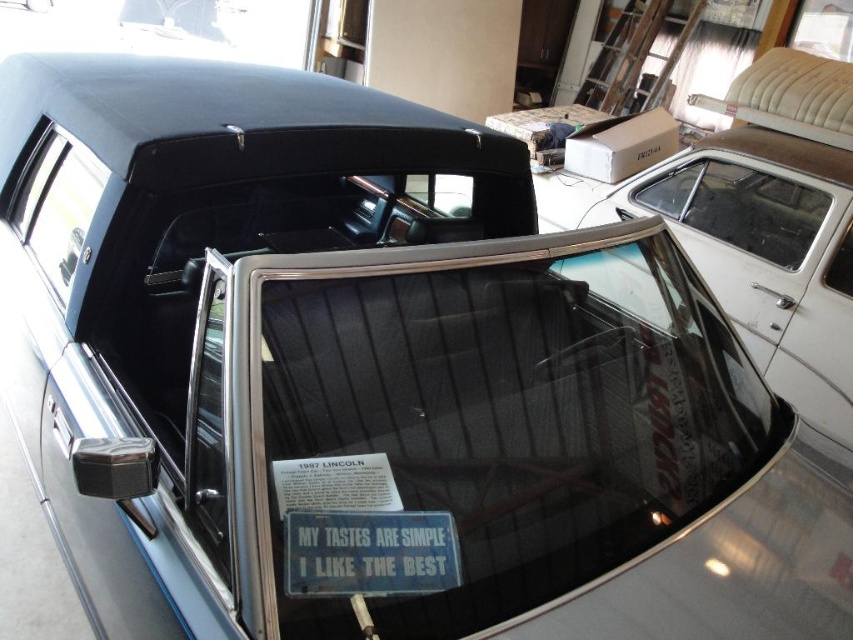
Between point (670, 387) and point (315, 586), which one is positioned in front?

Point (315, 586)

In order to click on transparent glass windshield at center in this screenshot , I will do `click(489, 420)`.

In the scene shown: Can you confirm if transparent glass window at upper center is smaller than clear glass window at upper left?

Actually, transparent glass window at upper center might be larger than clear glass window at upper left.

Between transparent glass window at upper center and clear glass window at upper left, which one has less height?

With less height is clear glass window at upper left.

Identify the location of transparent glass window at upper center. (740, 208).

Between transparent glass windshield at center and clear glass window at upper left, which one has less height?

Standing shorter between the two is clear glass window at upper left.

Is transparent glass windshield at center bigger than clear glass window at upper left?

Yes, transparent glass windshield at center is bigger than clear glass window at upper left.

This screenshot has height=640, width=853. I want to click on transparent glass windshield at center, so coord(489,420).